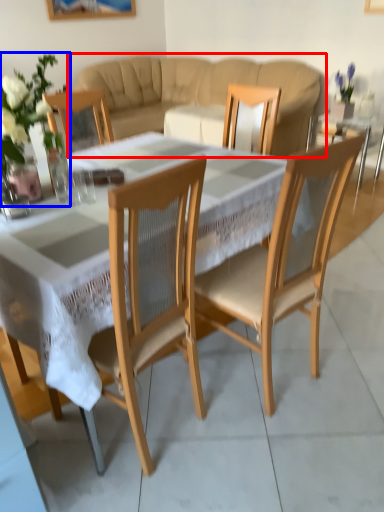
Question: Among these objects, which one is farthest to the camera, studio couch (highlighted by a red box) or floral arrangement (highlighted by a blue box)?

Choices:
 (A) studio couch
 (B) floral arrangement

Answer: (A)